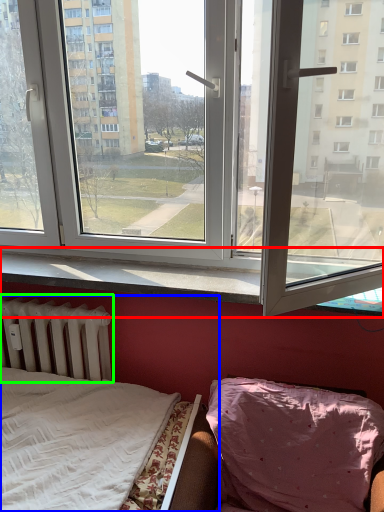
Question: Estimate the real-world distances between objects in this image. Which object is closer to window sill (highlighted by a red box), bed (highlighted by a blue box) or radiator (highlighted by a green box)?

Choices:
 (A) bed
 (B) radiator

Answer: (B)